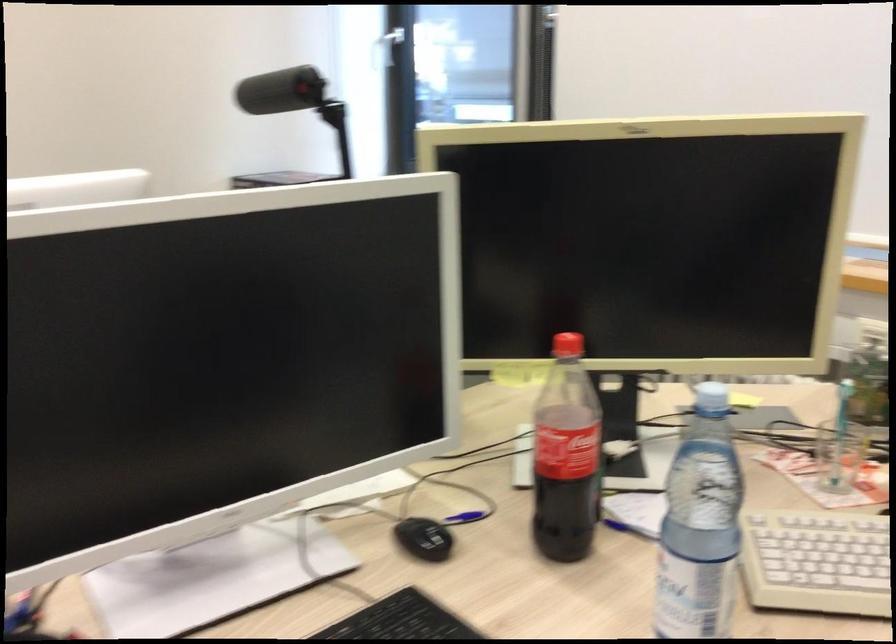
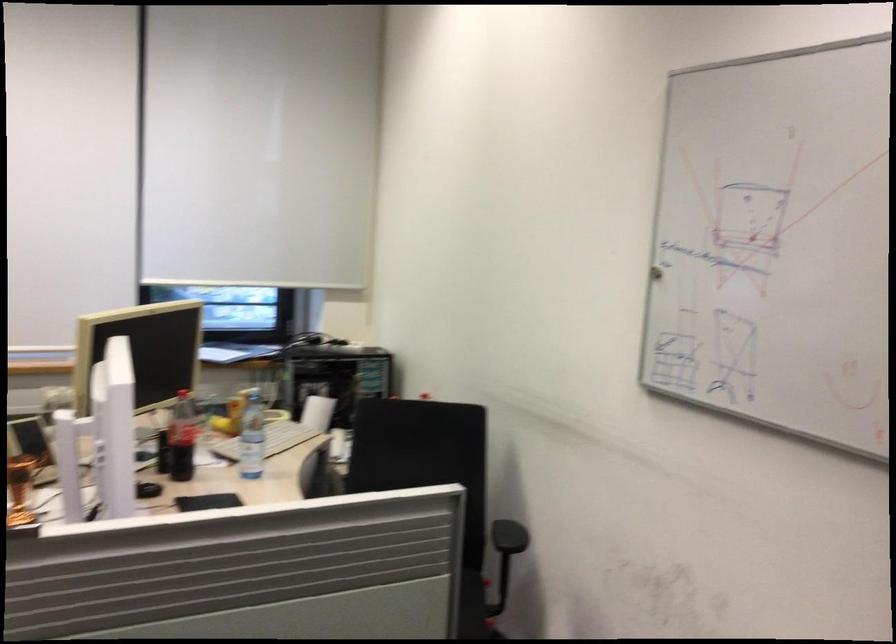
Question: I am providing you with two images of the same scene from different viewpoints. Which of the following objects are not visible in image2?

Choices:
 (A) chair armrest
 (B) black computer mouse
 (C) red stool top
 (D) coca-cola bottle

Answer: (B)